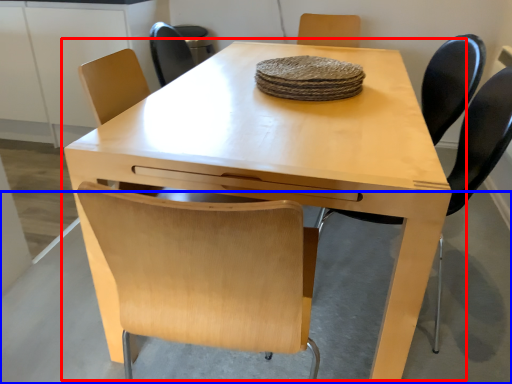
Question: Which point is further to the camera, table (highlighted by a red box) or concrete (highlighted by a blue box)?

Choices:
 (A) table
 (B) concrete

Answer: (B)